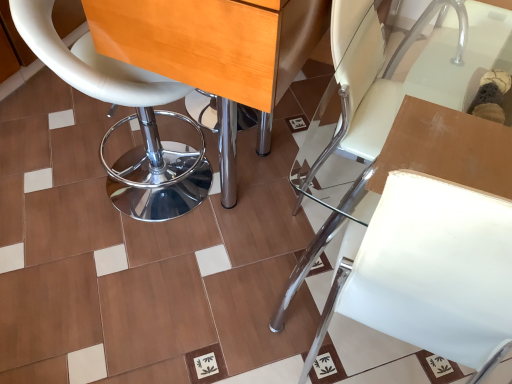
Where is `vacant space underneath wooden table at center (from a real-world perspective)`? The height and width of the screenshot is (384, 512). vacant space underneath wooden table at center (from a real-world perspective) is located at coordinates (268, 160).